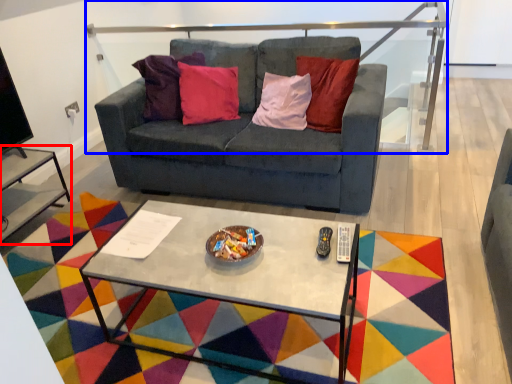
Question: Which point is closer to the camera, side table (highlighted by a red box) or balustrade (highlighted by a blue box)?

Choices:
 (A) side table
 (B) balustrade

Answer: (A)